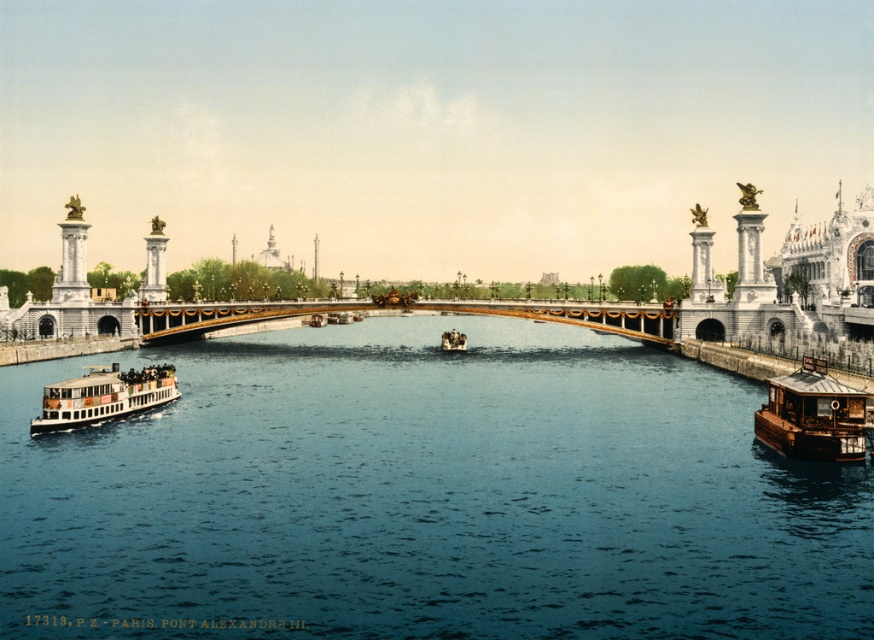
Question: Which is nearer to the white polished wood boat at lower left?

Choices:
 (A) wooden polished boat at center
 (B) blue water at center
 (C) wooden cabin boat at lower right

Answer: (B)

Question: Among these points, which one is farthest from the camera?

Choices:
 (A) (563, 372)
 (B) (66, 419)
 (C) (599, 314)
 (D) (824, 387)

Answer: (C)

Question: Is wooden cabin boat at lower right above wooden polished boat at center?

Choices:
 (A) yes
 (B) no

Answer: (B)

Question: From the image, what is the correct spatial relationship of blue water at center in relation to gold polished metal bridge at center?

Choices:
 (A) right
 (B) left

Answer: (B)

Question: Is blue water at center positioned behind white polished wood boat at lower left?

Choices:
 (A) no
 (B) yes

Answer: (A)

Question: Which point is farther to the camera?

Choices:
 (A) wooden cabin boat at lower right
 (B) gold polished metal bridge at center
 (C) blue water at center

Answer: (B)